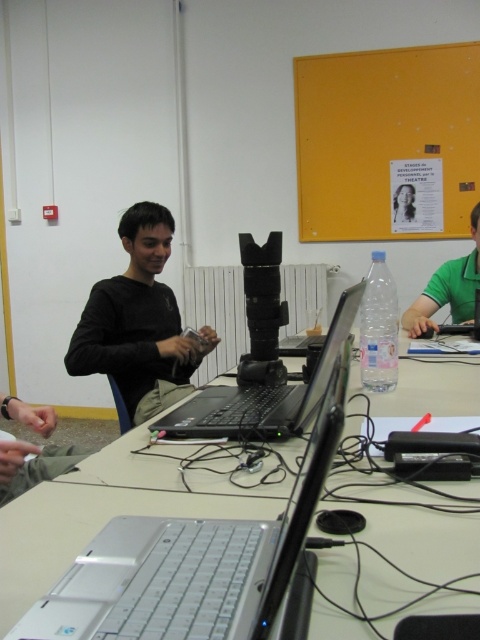
Question: Where is green fabric shirt at center located in relation to black plastic laptop at center in the image?

Choices:
 (A) left
 (B) right

Answer: (A)

Question: Which point appears closest to the camera in this image?

Choices:
 (A) (140, 333)
 (B) (476, 296)
 (C) (458, 273)
 (D) (388, 129)

Answer: (A)

Question: Can you confirm if yellow matte bulletin board at upper right is smaller than green fabric shirt at center?

Choices:
 (A) no
 (B) yes

Answer: (A)

Question: Where is yellow matte bulletin board at upper right located in relation to matte black laptop at center in the image?

Choices:
 (A) above
 (B) below

Answer: (A)

Question: Which object is closer to the camera taking this photo?

Choices:
 (A) black matte laptop at center
 (B) black plastic laptop at center

Answer: (A)

Question: Which object is farther from the camera taking this photo?

Choices:
 (A) matte black laptop at center
 (B) black matte shirt at center

Answer: (A)